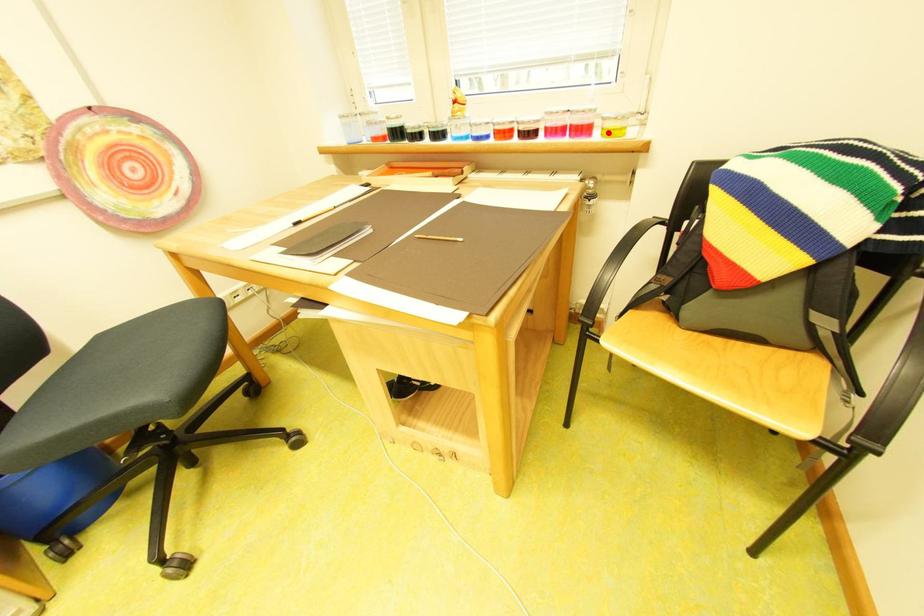
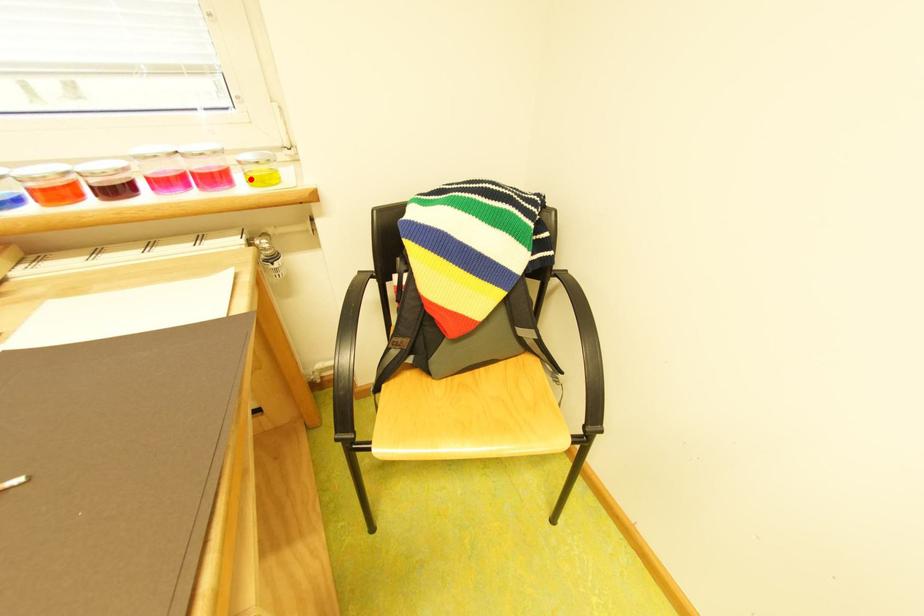
I am providing you with two images of the same scene from different viewpoints. A red point is marked on the first image and another point is marked on the second image. Are the points marked in image1 and image2 representing the same 3D position?

Yes